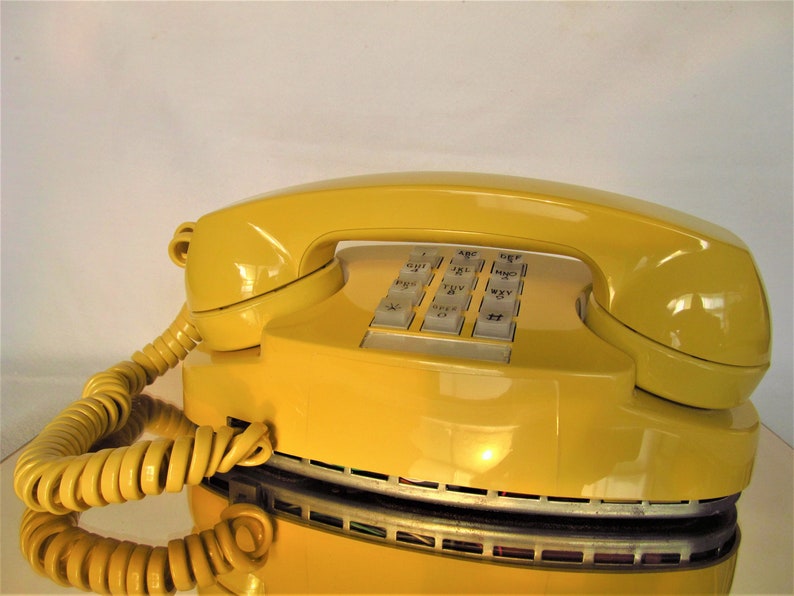
The width and height of the screenshot is (794, 596). Identify the location of telephone. (457, 439).